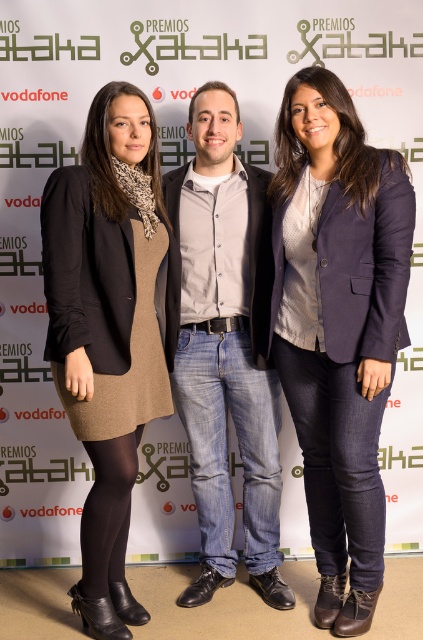
Question: Which object appears closest to the camera in this image?

Choices:
 (A) navy blue blazer at center
 (B) matte black blazer at left
 (C) denim jeans at center

Answer: (B)

Question: Can you confirm if navy blue blazer at center is positioned above matte black blazer at left?

Choices:
 (A) no
 (B) yes

Answer: (B)

Question: Does matte black blazer at left have a smaller size compared to denim jeans at center?

Choices:
 (A) yes
 (B) no

Answer: (B)

Question: Considering the real-world distances, which object is closest to the matte black blazer at left?

Choices:
 (A) denim jeans at center
 (B) navy blue blazer at center

Answer: (A)

Question: Which point is farther from the camera taking this photo?

Choices:
 (A) (304, 180)
 (B) (112, 614)
 (C) (246, 275)

Answer: (C)

Question: Does navy blue blazer at center come behind denim jeans at center?

Choices:
 (A) no
 (B) yes

Answer: (A)